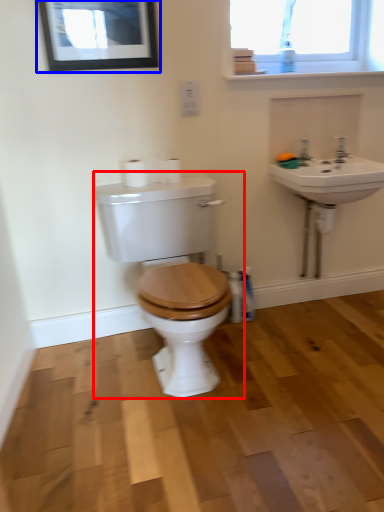
Question: Which point is closer to the camera, toilet (highlighted by a red box) or picture frame (highlighted by a blue box)?

Choices:
 (A) toilet
 (B) picture frame

Answer: (A)